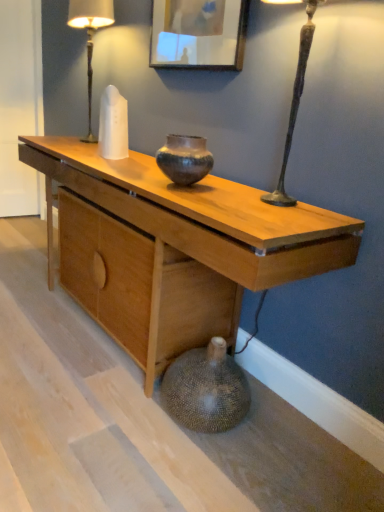
Question: Is natural wood desk at center not close to earthy brown ceramic vase at center?

Choices:
 (A) yes
 (B) no

Answer: (B)

Question: Is natural wood desk at center shorter than earthy brown ceramic vase at center?

Choices:
 (A) yes
 (B) no

Answer: (B)

Question: From the image's perspective, is natural wood desk at center on top of earthy brown ceramic vase at center?

Choices:
 (A) no
 (B) yes

Answer: (A)

Question: Is natural wood desk at center outside of earthy brown ceramic vase at center?

Choices:
 (A) no
 (B) yes

Answer: (B)

Question: From the image's perspective, is natural wood desk at center below earthy brown ceramic vase at center?

Choices:
 (A) no
 (B) yes

Answer: (B)

Question: Looking at their shapes, would you say natural wood desk at center is wider or thinner than earthy brown ceramic vase at center?

Choices:
 (A) thin
 (B) wide

Answer: (B)

Question: From a real-world perspective, is natural wood desk at center positioned above or below earthy brown ceramic vase at center?

Choices:
 (A) above
 (B) below

Answer: (B)

Question: In terms of size, does natural wood desk at center appear bigger or smaller than earthy brown ceramic vase at center?

Choices:
 (A) small
 (B) big

Answer: (B)

Question: Is natural wood desk at center to the left or to the right of earthy brown ceramic vase at center in the image?

Choices:
 (A) left
 (B) right

Answer: (A)

Question: From the image's perspective, is earthy brown ceramic vase at center located above or below natural wood desk at center?

Choices:
 (A) below
 (B) above

Answer: (B)

Question: Relative to natural wood desk at center, is earthy brown ceramic vase at center in front or behind?

Choices:
 (A) behind
 (B) front

Answer: (A)

Question: Would you say earthy brown ceramic vase at center is to the left or to the right of natural wood desk at center in the picture?

Choices:
 (A) left
 (B) right

Answer: (B)

Question: From a real-world perspective, relative to natural wood desk at center, is earthy brown ceramic vase at center vertically above or below?

Choices:
 (A) below
 (B) above

Answer: (B)

Question: Is point click(x=117, y=198) positioned closer to the camera than point click(x=92, y=31)?

Choices:
 (A) farther
 (B) closer

Answer: (B)

Question: Is natural wood desk at center in front of or behind white glass table lamp at upper left in the image?

Choices:
 (A) front
 (B) behind

Answer: (A)